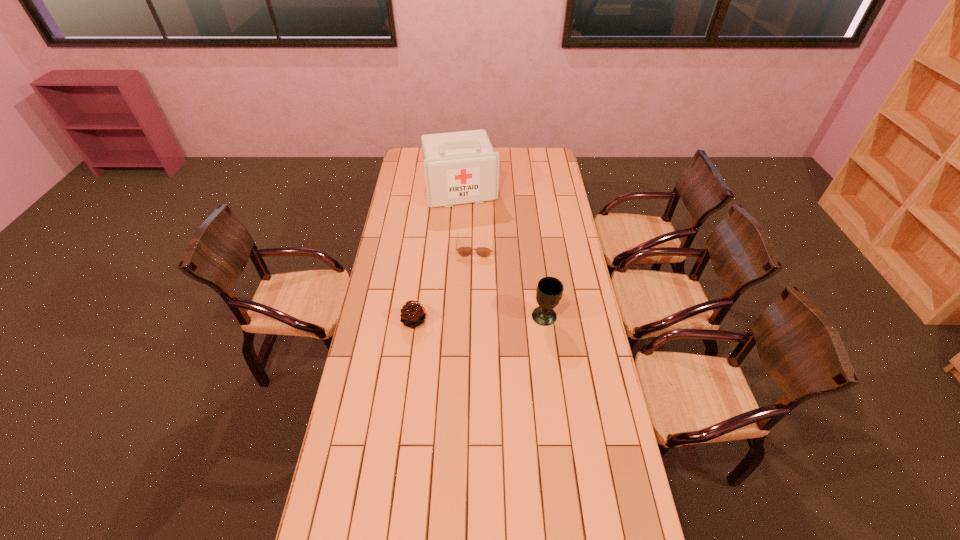
At what (x,y) coordinates should I click in order to perform the action: click on object that can be found as the second closest to the second farthest object. Please return your answer as a coordinate pair (x, y). This screenshot has width=960, height=540. Looking at the image, I should click on (413, 314).